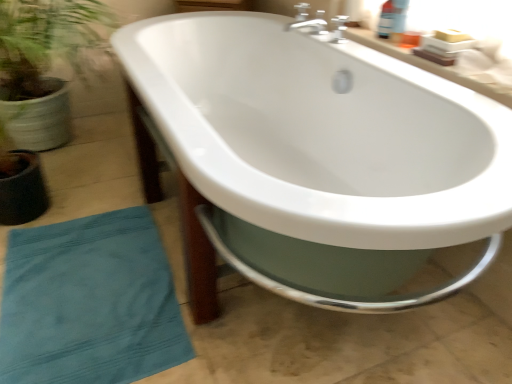
Question: Can you confirm if white glossy bathtub at center is smaller than white glossy countertop at upper right?

Choices:
 (A) yes
 (B) no

Answer: (B)

Question: Is white glossy bathtub at center positioned behind white glossy countertop at upper right?

Choices:
 (A) yes
 (B) no

Answer: (B)

Question: Is white glossy bathtub at center positioned with its back to white glossy countertop at upper right?

Choices:
 (A) no
 (B) yes

Answer: (B)

Question: From a real-world perspective, is white glossy bathtub at center beneath white glossy countertop at upper right?

Choices:
 (A) yes
 (B) no

Answer: (A)

Question: Is white glossy bathtub at center shorter than white glossy countertop at upper right?

Choices:
 (A) yes
 (B) no

Answer: (B)

Question: In terms of size, does white glossy bathtub at center appear bigger or smaller than white glossy countertop at upper right?

Choices:
 (A) small
 (B) big

Answer: (B)

Question: Considering the positions of white glossy bathtub at center and white glossy countertop at upper right in the image, is white glossy bathtub at center taller or shorter than white glossy countertop at upper right?

Choices:
 (A) short
 (B) tall

Answer: (B)

Question: Is white glossy bathtub at center in front of or behind white glossy countertop at upper right in the image?

Choices:
 (A) front
 (B) behind

Answer: (A)

Question: Would you say white glossy bathtub at center is inside or outside white glossy countertop at upper right?

Choices:
 (A) inside
 (B) outside

Answer: (B)

Question: In terms of height, does white glossy bathtub at center look taller or shorter compared to teal cotton beach towel at lower left?

Choices:
 (A) short
 (B) tall

Answer: (B)

Question: In the image, is white glossy bathtub at center on the left side or the right side of teal cotton beach towel at lower left?

Choices:
 (A) left
 (B) right

Answer: (B)

Question: In terms of width, does white glossy bathtub at center look wider or thinner when compared to teal cotton beach towel at lower left?

Choices:
 (A) thin
 (B) wide

Answer: (B)

Question: Based on their sizes in the image, would you say white glossy bathtub at center is bigger or smaller than teal cotton beach towel at lower left?

Choices:
 (A) big
 (B) small

Answer: (A)

Question: Considering the positions of white glossy countertop at upper right and teal cotton beach towel at lower left in the image, is white glossy countertop at upper right taller or shorter than teal cotton beach towel at lower left?

Choices:
 (A) short
 (B) tall

Answer: (A)

Question: Is white glossy countertop at upper right wider or thinner than teal cotton beach towel at lower left?

Choices:
 (A) thin
 (B) wide

Answer: (A)